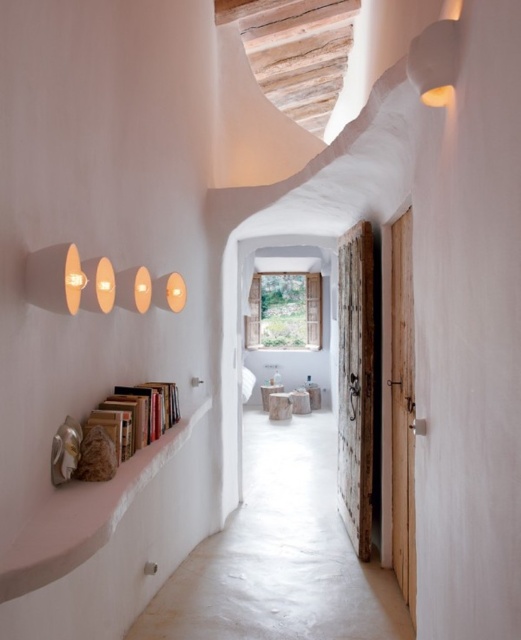
Question: Which of the following is the farthest from the observer?

Choices:
 (A) (160, 396)
 (B) (108, 512)

Answer: (A)

Question: Does white stucco ledge at lower left have a greater width compared to wooden bookshelf at left?

Choices:
 (A) no
 (B) yes

Answer: (B)

Question: Observing the image, what is the correct spatial positioning of white stucco ledge at lower left in reference to wooden bookshelf at left?

Choices:
 (A) below
 (B) above

Answer: (A)

Question: Does white stucco ledge at lower left have a lesser width compared to wooden bookshelf at left?

Choices:
 (A) yes
 (B) no

Answer: (B)

Question: Which point is farther to the camera?

Choices:
 (A) (196, 412)
 (B) (96, 417)

Answer: (A)